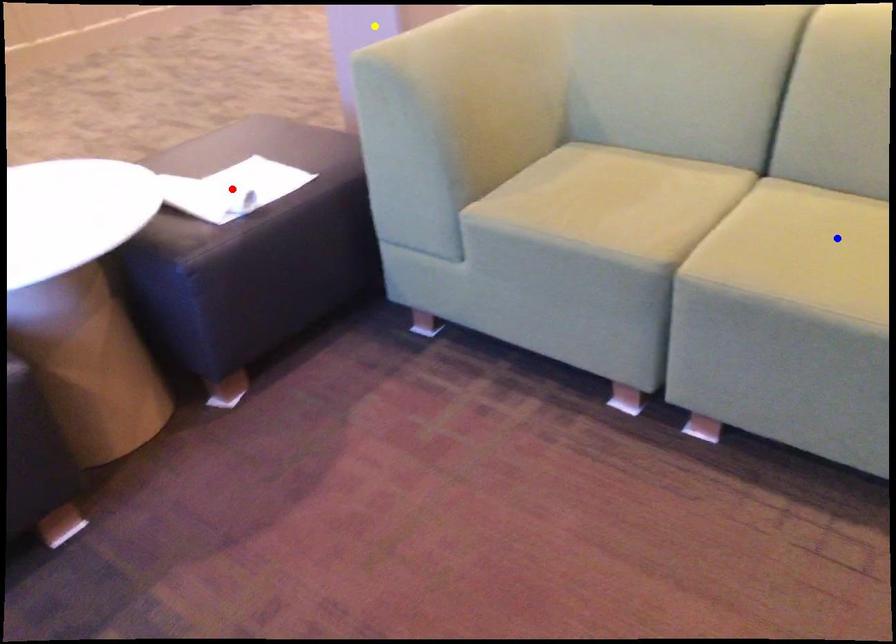
Order these from farthest to nearest:
yellow point
red point
blue point

yellow point → red point → blue point